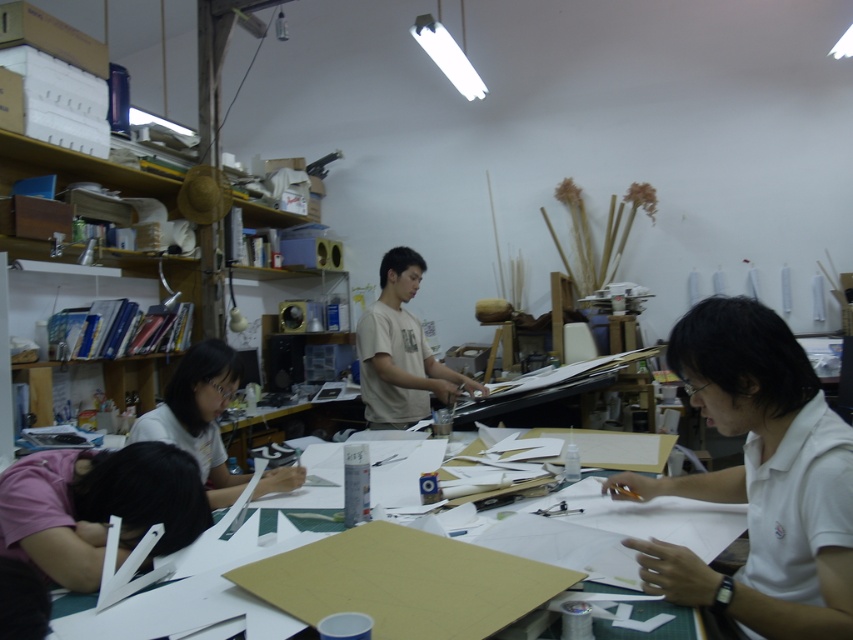
The width and height of the screenshot is (853, 640). Describe the element at coordinates (759, 477) in the screenshot. I see `white matte shirt at lower right` at that location.

Who is positioned more to the left, white matte shirt at lower right or white matte shirt at center?

white matte shirt at center

Does point (680, 339) lie in front of point (196, 428)?

Yes, it is.

Find the location of a particular element. This screenshot has width=853, height=640. white matte shirt at lower right is located at coordinates (759, 477).

Can you confirm if white matte shirt at lower right is positioned to the left of light brown t-shirt at center?

Incorrect, white matte shirt at lower right is not on the left side of light brown t-shirt at center.

Can you confirm if white matte shirt at lower right is positioned below light brown t-shirt at center?

Yes.

From the picture: Who is more forward, (811, 563) or (413, 374)?

Point (811, 563) is more forward.

Locate an element on the screen. Image resolution: width=853 pixels, height=640 pixels. white matte shirt at lower right is located at coordinates (759, 477).

In the scene shown: Which is above, light brown t-shirt at center or white matte shirt at center?

Positioned higher is light brown t-shirt at center.

Between light brown t-shirt at center and white matte shirt at center, which one has less height?

Standing shorter between the two is white matte shirt at center.

From the picture: Who is more forward, (445, 397) or (148, 440)?

Point (148, 440)

Identify the location of light brown t-shirt at center. This screenshot has width=853, height=640. (399, 352).